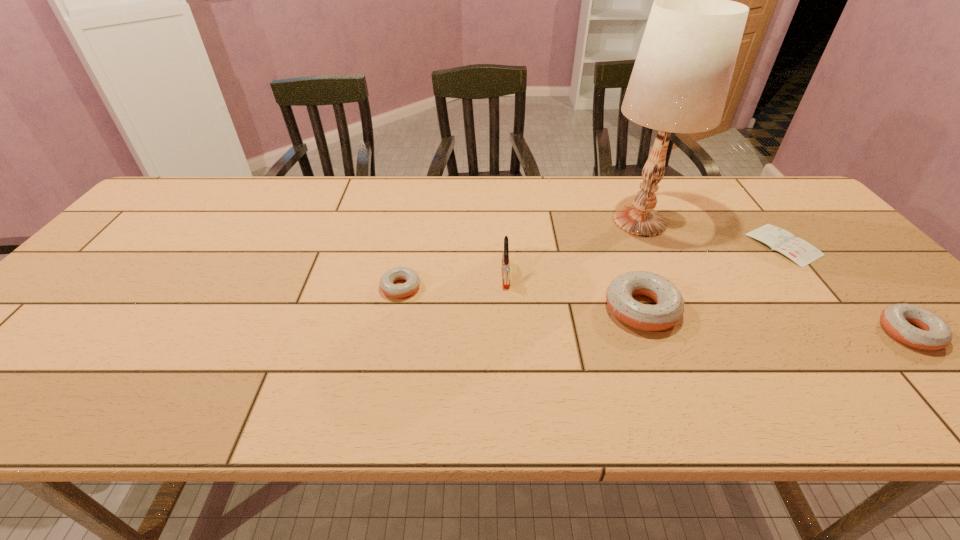
Please point out where to position a new doughnut on the left to maintain spacing. Please provide its 2D coordinates. Your answer should be formatted as a tuple, i.e. [(x, y)], where the tuple contains the x and y coordinates of a point satisfying the conditions above.

[(182, 268)]